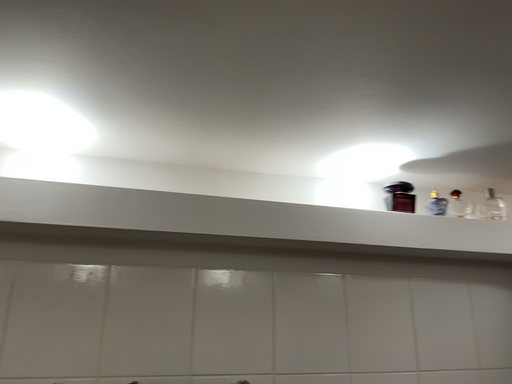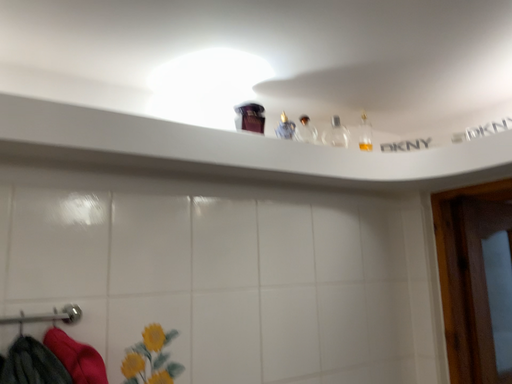
Question: Which way did the camera rotate in the video?

Choices:
 (A) rotated upward
 (B) rotated downward

Answer: (B)